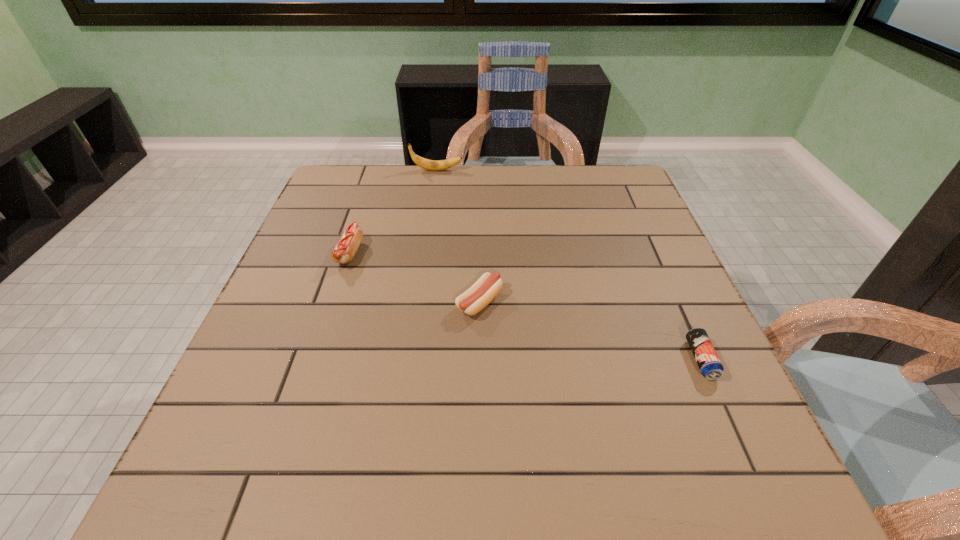
At what (x,y) coordinates should I click in order to perform the action: click on free location located on the front of the third farthest object. Please return your answer as a coordinate pair (x, y). The width and height of the screenshot is (960, 540). Looking at the image, I should click on 479,487.

The image size is (960, 540). Identify the location of free space located 0.100m on the front of the rightmost object. tap(733, 433).

Find the location of a particular element. object present at the far edge is located at coordinates (427, 164).

Find the location of a particular element. The image size is (960, 540). object at the left edge is located at coordinates (344, 251).

Identify the location of object that is positioned at the right edge. tap(704, 353).

The image size is (960, 540). Find the location of `free space at the far edge of the desktop`. free space at the far edge of the desktop is located at coordinates (423, 204).

This screenshot has width=960, height=540. I want to click on free spot at the near edge of the desktop, so click(391, 456).

In the image, there is a desktop. Identify the location of vacant space at the left edge. click(x=329, y=247).

Find the location of `vacant space at the right edge of the desktop`. vacant space at the right edge of the desktop is located at coordinates (607, 210).

In the image, there is a desktop. At what (x,y) coordinates should I click in order to perform the action: click on vacant space at the far left corner. Please return your answer as a coordinate pair (x, y). This screenshot has width=960, height=540. Looking at the image, I should click on (348, 200).